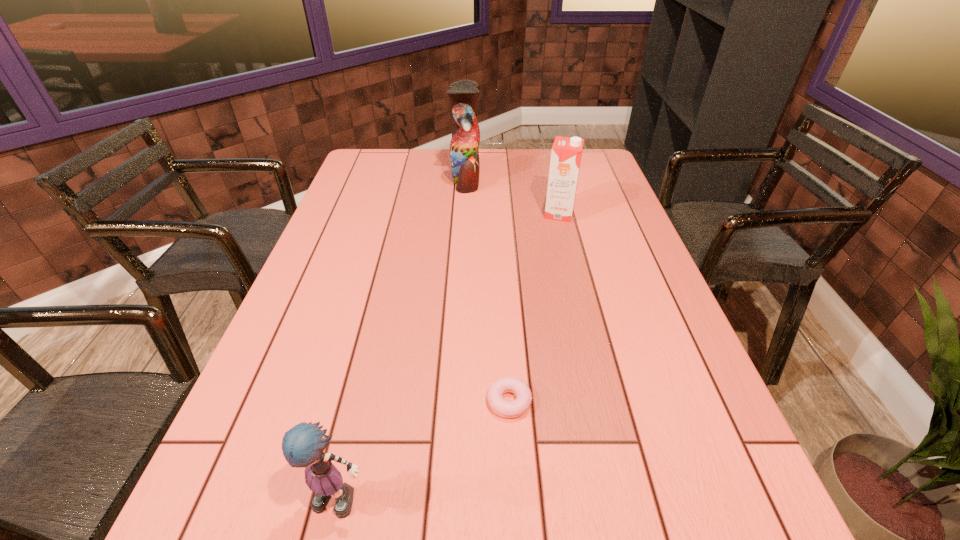
Identify the location of the third object from right to left. (464, 154).

This screenshot has width=960, height=540. I want to click on the tallest object, so click(464, 154).

The height and width of the screenshot is (540, 960). Identify the location of carton. (566, 154).

Image resolution: width=960 pixels, height=540 pixels. Find the location of `the rightmost object`. the rightmost object is located at coordinates (566, 154).

Where is `the third tallest object`? the third tallest object is located at coordinates (303, 445).

The image size is (960, 540). I want to click on the nearest object, so click(303, 445).

Locate an element on the screen. the third object from left to right is located at coordinates (510, 409).

You are a GUI agent. You are given a task and a screenshot of the screen. Output one action in this format:
    pyautogui.click(x=<x>, y=<y>)
    Task: Click on the shortest object
    
    Given the screenshot: What is the action you would take?
    pyautogui.click(x=510, y=409)

Identify the location of free space located 0.190m at the face of the farthest object. (534, 178).

You are a GUI agent. You are given a task and a screenshot of the screen. Output one action in this format:
    pyautogui.click(x=<x>, y=<y>)
    Task: Click on the free region located on the left of the carton
    The image size is (960, 540).
    Given the screenshot: What is the action you would take?
    pyautogui.click(x=489, y=214)